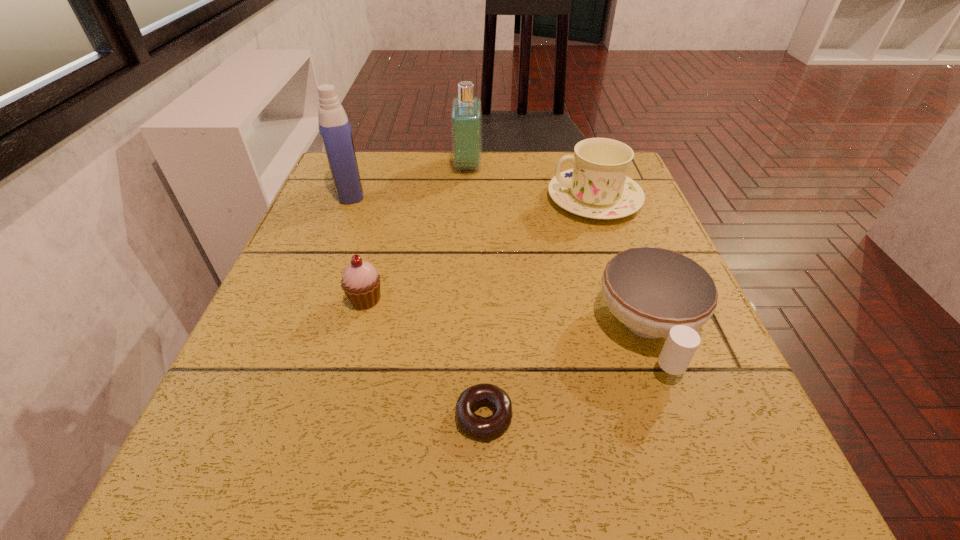
Locate an element on the screen. This screenshot has width=960, height=540. free space in the image that satisfies the following two spatial constraints: 1. on the back side of the nearest object; 2. on the front label of the second tallest object is located at coordinates coord(482,166).

Identify the location of free space that satisfies the following two spatial constraints: 1. on the front label of the doughnut; 2. on the left side of the perfume. Image resolution: width=960 pixels, height=540 pixels. click(458, 416).